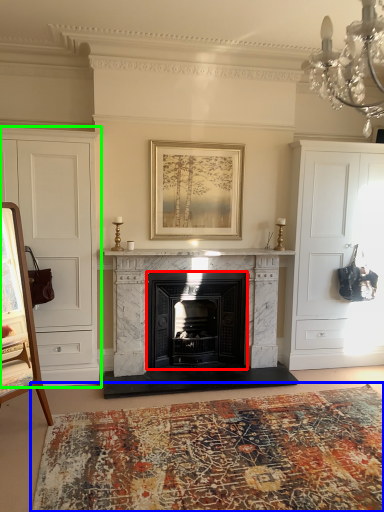
Question: Estimate the real-world distances between objects in this image. Which object is farther from fireplace (highlighted by a red box), plain (highlighted by a blue box) or cabinetry (highlighted by a green box)?

Choices:
 (A) plain
 (B) cabinetry

Answer: (A)